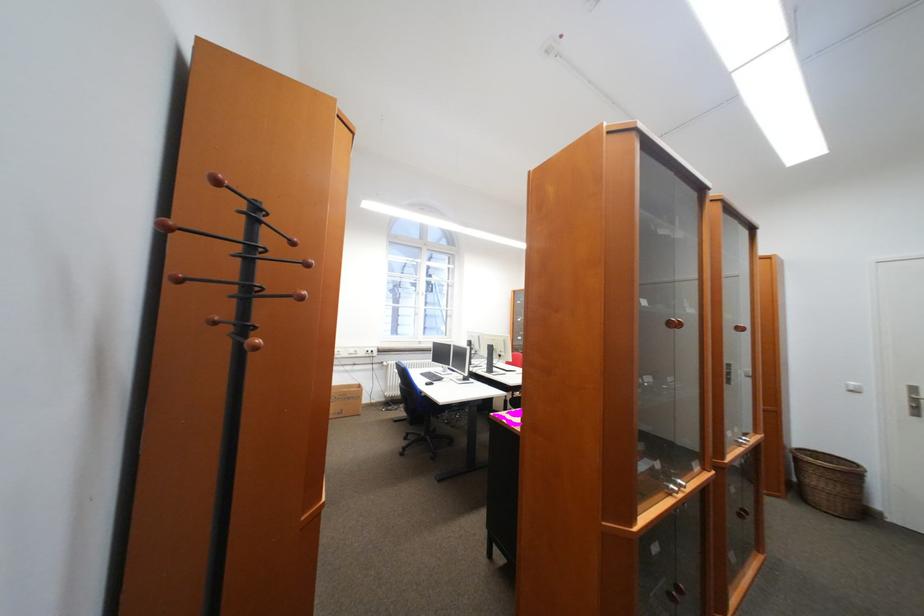
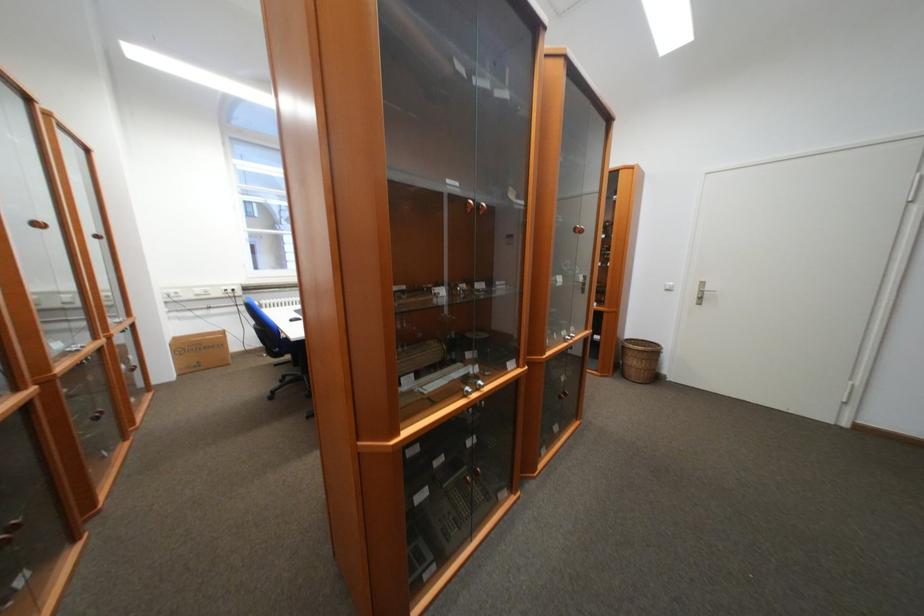
Where in the second image is the point corresponding to point (359, 350) from the first image?

(203, 290)